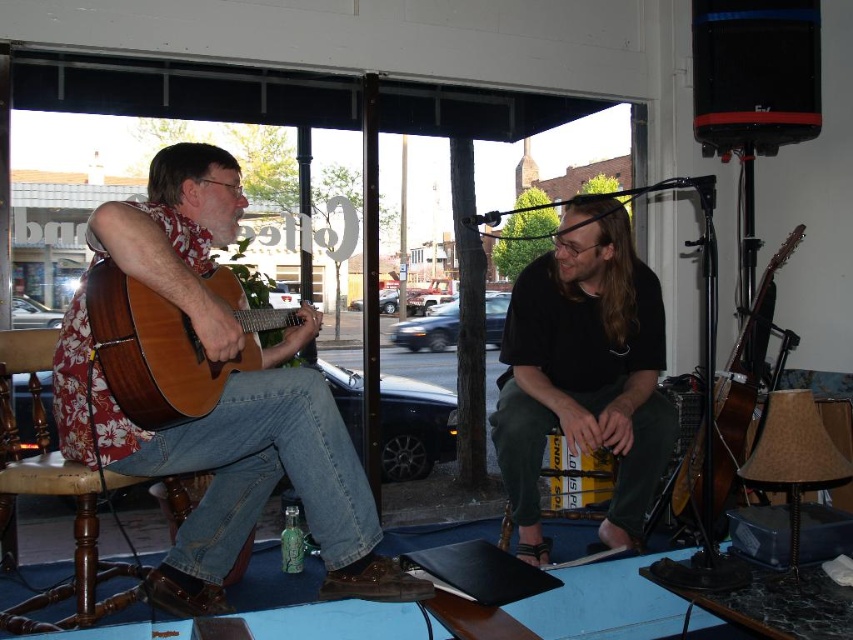
You are a stagehand setting up for a performance. You need to place a 18 inch wide amplifier between the natural wood acoustic guitar at left and the brown wooden stool at lower left. Is there enough space?

The natural wood acoustic guitar at left is 17.82 inches from the brown wooden stool at lower left. Since the amplifier is 18 inches wide, there isn not enough space to place it between them.

You are a stagehand setting up for a performance. You need to place a new microphone stand exactly 0.2 units to the right of the natural wood acoustic guitar at left. What are the coordinates where you should place the new microphone stand?

The natural wood acoustic guitar at left is located at point (x=167, y=344). Adding 0.2 units to the x coordinate gives 0.739. The new microphone stand should be placed at coordinates (x=167, y=472).